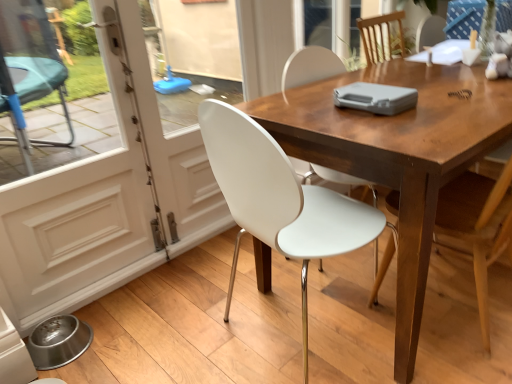
Find the location of `vacant space underneath white plastic chair at center, marked as the second chair in a right-to-left arrangement (from a real-world perspective)`. vacant space underneath white plastic chair at center, marked as the second chair in a right-to-left arrangement (from a real-world perspective) is located at coordinates (278, 340).